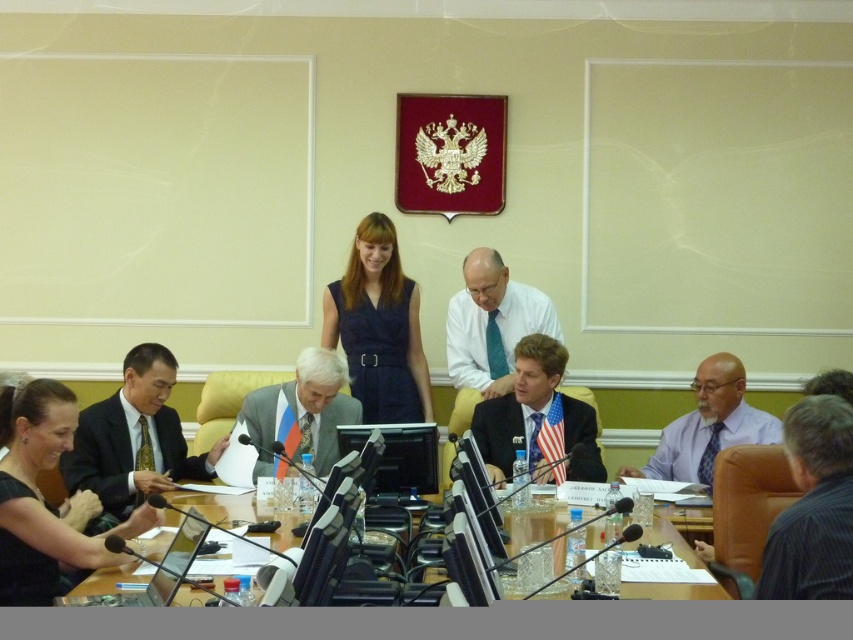
You are an event organizer who needs to arrange chairs for a followup meeting. The chairs are all the same width. Given that the dark suit at center and blue suit at center are seated next to each other, which person requires a wider chair?

The dark suit at center requires a wider chair because the dark suit at center is wider than the blue suit at center.

You are a photographer positioned at the back of the room. You want to take a photo of the blue suit at center and the wooden table at center. Which object will appear narrower in your photo?

The blue suit at center is thinner than the wooden table at center, so it will appear narrower in the photo.